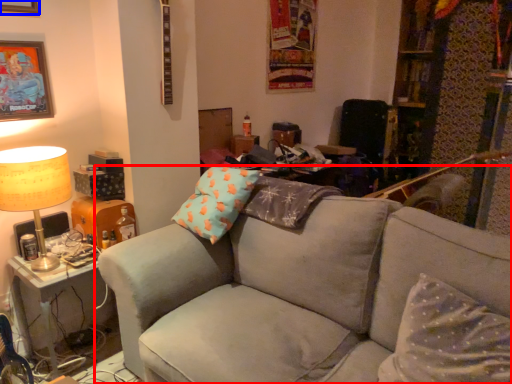
Question: Which object appears closest to the camera in this image, studio couch (highlighted by a red box) or picture frame (highlighted by a blue box)?

Choices:
 (A) studio couch
 (B) picture frame

Answer: (A)